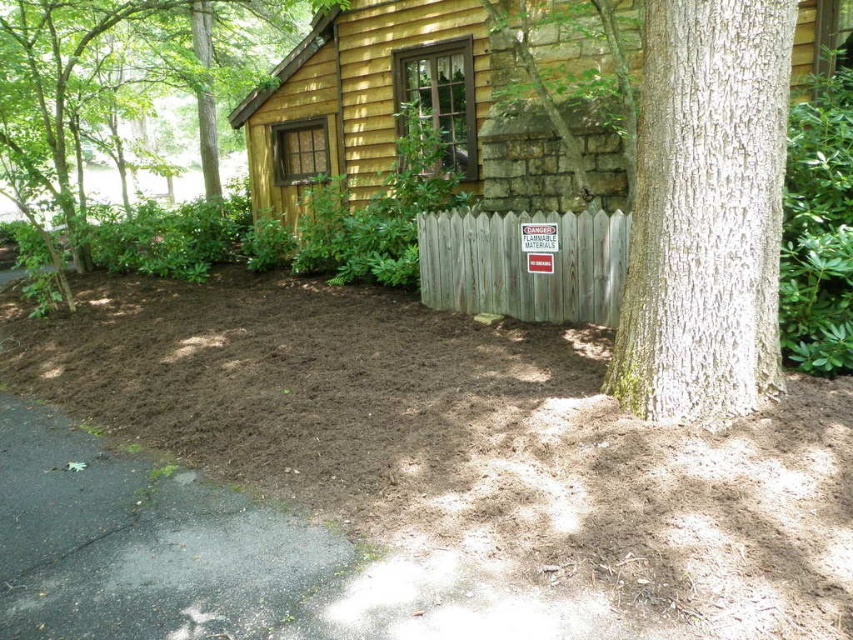
You are standing in front of the cabin and notice the brown textured tree at left and the weathered wood fence at center. Which object takes up more area in the scene?

The weathered wood fence at center occupies more space than the brown textured tree at left according to the description.

You are standing in front of the cabin and notice the brown textured tree at left and the weathered wood fence at center. Which object is positioned higher in the scene?

The brown textured tree at left is positioned higher than the weathered wood fence at center.

You are standing in front of the wooden cabin at center and want to walk towards the brown textured tree at left. Which direction should you face to move directly towards the tree?

You should face left to move directly towards the brown textured tree at left since the wooden cabin at center is to the right of the tree.